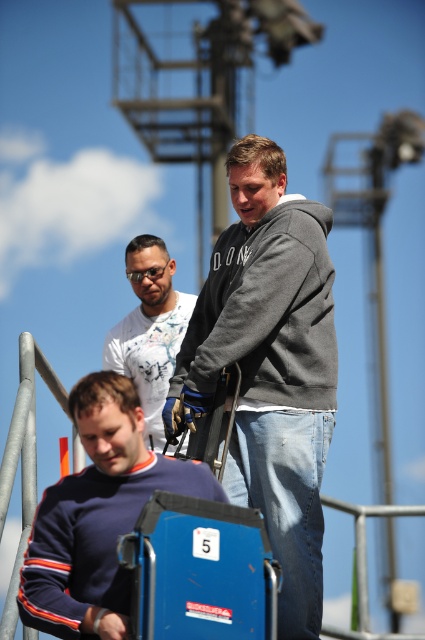
Which is in front, point (125, 384) or point (141, 339)?

Point (125, 384)

Does navy blue sweater at lower left come behind white printed t-shirt at center?

No, it is not.

Is point (226, 497) farther from camera compared to point (149, 378)?

That is False.

I want to click on navy blue sweater at lower left, so click(98, 515).

Between blue plastic lift at lower center and white printed t-shirt at center, which one has less height?

blue plastic lift at lower center

Can you confirm if blue plastic lift at lower center is smaller than white printed t-shirt at center?

Indeed, blue plastic lift at lower center has a smaller size compared to white printed t-shirt at center.

Between point (206, 600) and point (158, 410), which one is positioned behind?

The point (158, 410) is more distant.

This screenshot has height=640, width=425. I want to click on blue plastic lift at lower center, so click(x=200, y=572).

Which is above, gray cotton hoodie at center or navy blue sweater at lower left?

gray cotton hoodie at center is above.

Does gray cotton hoodie at center have a lesser height compared to navy blue sweater at lower left?

Incorrect, gray cotton hoodie at center's height does not fall short of navy blue sweater at lower left's.

Which is in front, point (218, 300) or point (99, 536)?

Positioned in front is point (99, 536).

Find the location of a particular element. gray cotton hoodie at center is located at coordinates (268, 310).